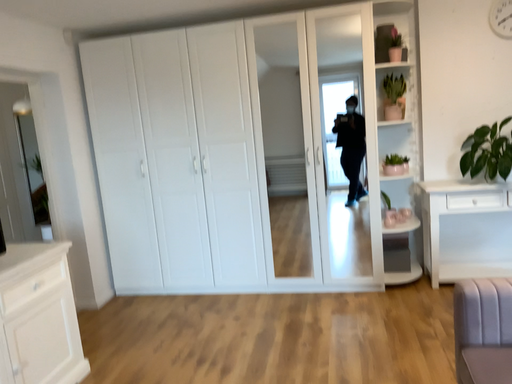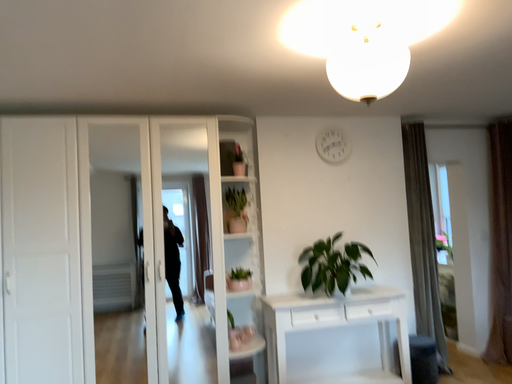
Question: How did the camera likely rotate when shooting the video?

Choices:
 (A) rotated right
 (B) rotated left

Answer: (A)